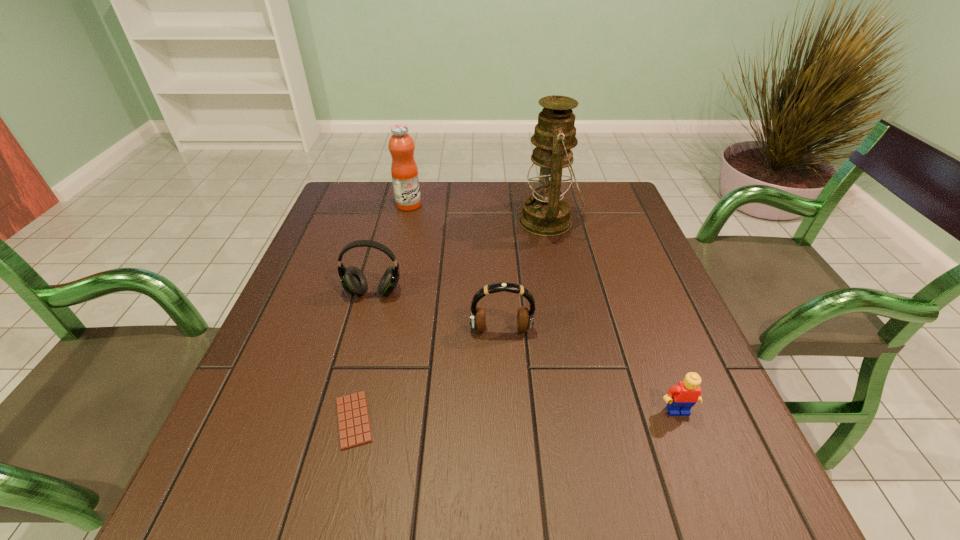
The height and width of the screenshot is (540, 960). What are the coordinates of `free point at the near edge` in the screenshot? It's located at (x=468, y=502).

Locate an element on the screen. Image resolution: width=960 pixels, height=540 pixels. blank space at the left edge of the desktop is located at coordinates coord(321,321).

Locate an element on the screen. This screenshot has height=540, width=960. free region at the right edge of the desktop is located at coordinates (615, 236).

At what (x,y) coordinates should I click in order to perform the action: click on free point at the near left corner. Please return your answer as a coordinate pair (x, y). Looking at the image, I should click on click(x=226, y=491).

In the image, there is a desktop. At what (x,y) coordinates should I click in order to perform the action: click on blank space at the far right corner. Please return your answer as a coordinate pair (x, y). Looking at the image, I should click on (612, 202).

Locate an element on the screen. Image resolution: width=960 pixels, height=540 pixels. vacant point located between the fruit juice and the rightmost object is located at coordinates (543, 308).

Identify the location of empty location between the tallest object and the shortest object. (451, 321).

This screenshot has height=540, width=960. Identify the location of empty location between the second shortest object and the fruit juice. (543, 308).

This screenshot has width=960, height=540. Find the location of `blank region between the second tallest object and the nearer headset`. blank region between the second tallest object and the nearer headset is located at coordinates (455, 267).

Find the location of a particular element. This screenshot has width=960, height=540. vacant area that lies between the candy bar and the right headset is located at coordinates (427, 375).